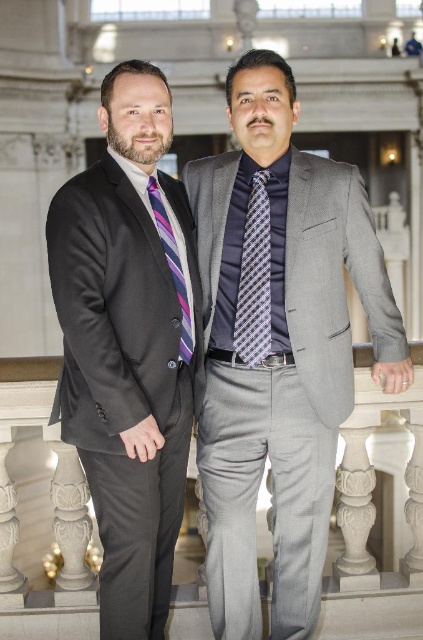
You are standing in the grand building shown in the image. There is a point marked at coordinates (375,518). What object in the scene corresponds to this coordinate?

The white marble balustrade at lower center corresponds to the coordinates (375,518).

You are taking a photo of the two men in the grand building. You want to focus on the point that is closer to you. Which point should you choose between point (200, 524) and point (183, 301)?

Point (183, 301) is closer to you than point (200, 524), so you should choose point (183, 301) to focus on the closer point.